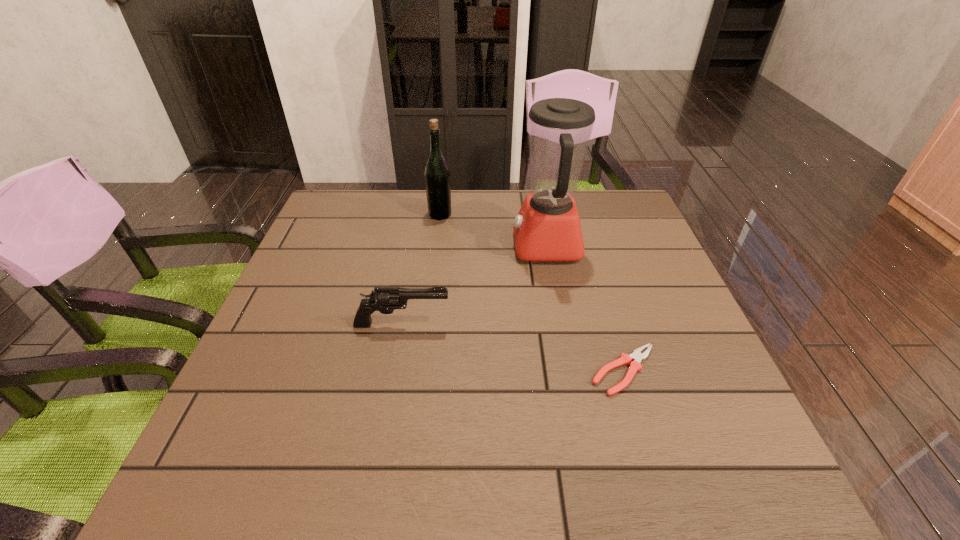
Where is `the tallest object`? the tallest object is located at coordinates point(547,228).

Find the location of a particular element. The image size is (960, 540). the second farthest object is located at coordinates (547, 228).

You are a GUI agent. You are given a task and a screenshot of the screen. Output one action in this format:
    pyautogui.click(x=<x>, y=<y>)
    Task: Click on the farthest object
    
    Given the screenshot: What is the action you would take?
    pyautogui.click(x=437, y=176)

Locate an element on the screen. This screenshot has height=540, width=960. beer bottle is located at coordinates (437, 176).

Locate an element on the screen. This screenshot has width=960, height=540. the third tallest object is located at coordinates (385, 300).

This screenshot has height=540, width=960. Find the location of `gun`. gun is located at coordinates (385, 300).

The width and height of the screenshot is (960, 540). In order to click on the nearest object in this screenshot , I will do `click(635, 365)`.

Identify the location of the shortest object. (635, 365).

Where is `vacant area situated 0.090m on the front of the tallest object near the controls`? Image resolution: width=960 pixels, height=540 pixels. vacant area situated 0.090m on the front of the tallest object near the controls is located at coordinates (479, 246).

Find the location of a particular element. Image resolution: width=960 pixels, height=540 pixels. free region located 0.100m on the front of the tallest object near the controls is located at coordinates (476, 246).